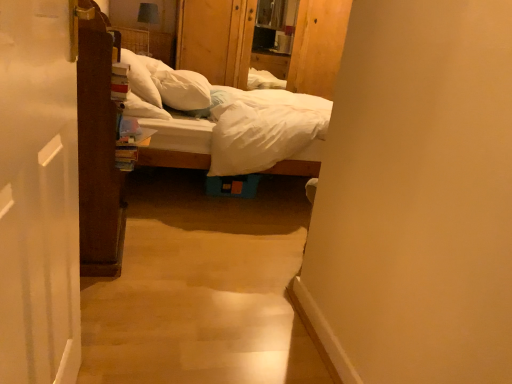
Question: Is white soft pillow at upper center, marked as the 2th pillow in a right-to-left arrangement, behind wooden dresser at center?

Choices:
 (A) no
 (B) yes

Answer: (A)

Question: From a real-world perspective, is white soft pillow at upper center, arranged as the first pillow when viewed from the left, physically below wooden dresser at center?

Choices:
 (A) no
 (B) yes

Answer: (B)

Question: Considering the relative sizes of white soft pillow at upper center, marked as the 2th pillow in a right-to-left arrangement, and wooden dresser at center in the image provided, is white soft pillow at upper center, marked as the 2th pillow in a right-to-left arrangement, shorter than wooden dresser at center?

Choices:
 (A) yes
 (B) no

Answer: (A)

Question: Could you tell me if white soft pillow at upper center, arranged as the first pillow when viewed from the left, is turned towards wooden dresser at center?

Choices:
 (A) yes
 (B) no

Answer: (B)

Question: Is white soft pillow at upper center, arranged as the first pillow when viewed from the left, at the right side of wooden dresser at center?

Choices:
 (A) no
 (B) yes

Answer: (A)

Question: Looking at their shapes, would you say white soft pillow at upper center, marked as the 2th pillow in a right-to-left arrangement, is wider or thinner than white soft pillow at center, the 2th pillow viewed from the left?

Choices:
 (A) thin
 (B) wide

Answer: (A)

Question: Is white soft pillow at upper center, marked as the 2th pillow in a right-to-left arrangement, in front of or behind white soft pillow at center, which is the first pillow in right-to-left order, in the image?

Choices:
 (A) front
 (B) behind

Answer: (A)

Question: From the image's perspective, relative to white soft pillow at center, which is the first pillow in right-to-left order, is white soft pillow at upper center, marked as the 2th pillow in a right-to-left arrangement, above or below?

Choices:
 (A) above
 (B) below

Answer: (A)

Question: Is white soft pillow at upper center, marked as the 2th pillow in a right-to-left arrangement, inside the boundaries of white soft pillow at center, the 2th pillow viewed from the left, or outside?

Choices:
 (A) inside
 (B) outside

Answer: (B)

Question: In terms of height, does wooden dresser at center look taller or shorter compared to white soft pillow at upper center, marked as the 2th pillow in a right-to-left arrangement?

Choices:
 (A) short
 (B) tall

Answer: (B)

Question: From the image's perspective, is wooden dresser at center above or below white soft pillow at upper center, marked as the 2th pillow in a right-to-left arrangement?

Choices:
 (A) above
 (B) below

Answer: (A)

Question: Is wooden dresser at center to the left or to the right of white soft pillow at upper center, arranged as the first pillow when viewed from the left, in the image?

Choices:
 (A) left
 (B) right

Answer: (B)

Question: Considering the positions of wooden dresser at center and white soft pillow at upper center, marked as the 2th pillow in a right-to-left arrangement, in the image, is wooden dresser at center bigger or smaller than white soft pillow at upper center, marked as the 2th pillow in a right-to-left arrangement,?

Choices:
 (A) big
 (B) small

Answer: (A)

Question: Is white cotton bed at center bigger or smaller than wooden dresser at center?

Choices:
 (A) small
 (B) big

Answer: (B)

Question: From the image's perspective, relative to wooden dresser at center, is white cotton bed at center above or below?

Choices:
 (A) above
 (B) below

Answer: (B)